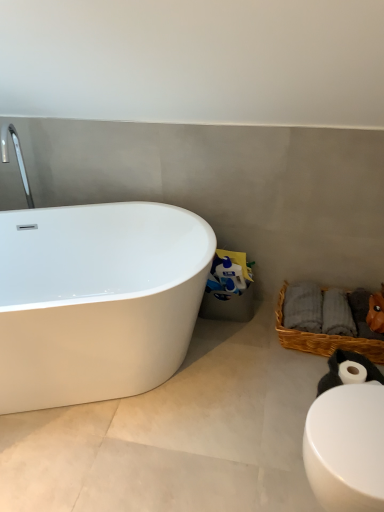
Describe the element at coordinates (337, 370) in the screenshot. I see `white matte toilet paper roll at lower right` at that location.

Describe the element at coordinates (97, 300) in the screenshot. I see `white glossy bathtub at left` at that location.

At what (x,y) coordinates should I click in order to perform the action: click on woven brown basket at lower right. Please return your answer as a coordinate pair (x, y). The image size is (384, 512). Looking at the image, I should click on (323, 339).

In order to click on white matte toilet paper roll at lower right in this screenshot , I will do `click(337, 370)`.

Find the location of a particular element. toilet that is under the white glossy bathtub at left (from a real-world perspective) is located at coordinates (346, 448).

How many degrees apart are the facing directions of white glossy bathtub at left and white glossy toilet at lower right?

The angular difference between white glossy bathtub at left and white glossy toilet at lower right is 111 degrees.

Considering the relative sizes of white glossy bathtub at left and white glossy toilet at lower right in the image provided, is white glossy bathtub at left smaller than white glossy toilet at lower right?

Actually, white glossy bathtub at left might be larger than white glossy toilet at lower right.

How distant is white glossy bathtub at left from white glossy toilet at lower right?

white glossy bathtub at left is 93.11 centimeters from white glossy toilet at lower right.

From the picture: Considering the sizes of objects white glossy toilet at lower right and woven brown basket at lower right in the image provided, who is smaller, white glossy toilet at lower right or woven brown basket at lower right?

woven brown basket at lower right.

Is point (375, 485) closer to viewer compared to point (282, 325)?

Yes, point (375, 485) is closer to viewer.

From the image's perspective, which is below, white glossy toilet at lower right or woven brown basket at lower right?

white glossy toilet at lower right, from the image's perspective.

Is woven brown basket at lower right oriented away from white matte toilet paper roll at lower right?

No, woven brown basket at lower right is not facing the opposite direction of white matte toilet paper roll at lower right.

Is white matte toilet paper roll at lower right inside woven brown basket at lower right?

No.

Does woven brown basket at lower right have a greater width compared to white matte toilet paper roll at lower right?

Correct, the width of woven brown basket at lower right exceeds that of white matte toilet paper roll at lower right.

Is woven brown basket at lower right touching white matte toilet paper roll at lower right?

They are not placed beside each other.

Choose the correct answer: Is white matte toilet paper roll at lower right inside white glossy bathtub at left or outside it?

white matte toilet paper roll at lower right lies outside white glossy bathtub at left.

From the picture: Does white matte toilet paper roll at lower right turn towards white glossy bathtub at left?

No, white matte toilet paper roll at lower right is not turned towards white glossy bathtub at left.

Does white matte toilet paper roll at lower right have a larger size compared to white glossy bathtub at left?

No, white matte toilet paper roll at lower right is not bigger than white glossy bathtub at left.

Can you confirm if white matte toilet paper roll at lower right is shorter than white glossy bathtub at left?

In fact, white matte toilet paper roll at lower right may be taller than white glossy bathtub at left.

Between point (329, 367) and point (277, 328), which one is positioned behind?

The point (277, 328) is behind.

Does white matte toilet paper roll at lower right appear on the right side of woven brown basket at lower right?

Incorrect, white matte toilet paper roll at lower right is not on the right side of woven brown basket at lower right.

Is white matte toilet paper roll at lower right located outside woven brown basket at lower right?

Yes, white matte toilet paper roll at lower right is located beyond the bounds of woven brown basket at lower right.

From a real-world perspective, does white matte toilet paper roll at lower right sit lower than woven brown basket at lower right?

No, from a real-world perspective, white matte toilet paper roll at lower right is not below woven brown basket at lower right.

Choose the correct answer: Is white glossy bathtub at left inside white glossy bathtub at left or outside it?

white glossy bathtub at left lies outside white glossy bathtub at left.

The image size is (384, 512). What are the coordinates of `bathtub that appears behind the white glossy bathtub at left` in the screenshot? It's located at (97, 300).

Is point (110, 412) in front of point (89, 274)?

Yes, point (110, 412) is closer to viewer.

Is white glossy toilet at lower right looking in the opposite direction of white glossy bathtub at left?

No, white glossy toilet at lower right is not facing the opposite direction of white glossy bathtub at left.

Between white glossy toilet at lower right and white glossy bathtub at left, which one has smaller size?

white glossy toilet at lower right.

Which is nearer, (370, 486) or (72, 240)?

The point (370, 486) is more forward.

From a real-world perspective, which is physically below, white glossy toilet at lower right or white glossy bathtub at left?

white glossy toilet at lower right.

Locate an element on the screen. The image size is (384, 512). bathtub on the left of white glossy toilet at lower right is located at coordinates (97, 300).

What are the coordinates of `toilet that appears above the woven brown basket at lower right (from a real-world perspective)` in the screenshot? It's located at (346, 448).

From the image, which object appears to be farther from white glossy bathtub at left, white matte toilet paper roll at lower right or woven brown basket at lower right?

white matte toilet paper roll at lower right lies further to white glossy bathtub at left than the other object.

Looking at the image, which one is located further to white glossy toilet at lower right, woven brown basket at lower right or white matte toilet paper roll at lower right?

woven brown basket at lower right is further to white glossy toilet at lower right.

Looking at this image, which object lies nearer to the anchor point white glossy bathtub at left, white glossy bathtub at left or woven brown basket at lower right?

Among the two, white glossy bathtub at left is located nearer to white glossy bathtub at left.

When comparing their distances from white glossy bathtub at left, does white matte toilet paper roll at lower right or woven brown basket at lower right seem further?

white matte toilet paper roll at lower right lies further to white glossy bathtub at left than the other object.

From the image, which object appears to be farther from white glossy bathtub at left, white glossy bathtub at left or white matte toilet paper roll at lower right?

Among the two, white matte toilet paper roll at lower right is located further to white glossy bathtub at left.

When comparing their distances from white glossy toilet at lower right, does white glossy bathtub at left or white matte toilet paper roll at lower right seem closer?

white matte toilet paper roll at lower right is closer to white glossy toilet at lower right.

Looking at the image, which one is located closer to white glossy toilet at lower right, woven brown basket at lower right or white glossy bathtub at left?

white glossy bathtub at left lies closer to white glossy toilet at lower right than the other object.

Based on their spatial positions, is white glossy bathtub at left or white matte toilet paper roll at lower right further from woven brown basket at lower right?

white glossy bathtub at left is further to woven brown basket at lower right.

I want to click on concrete between white glossy toilet at lower right and white matte toilet paper roll at lower right from front to back, so click(x=177, y=434).

Image resolution: width=384 pixels, height=512 pixels. Identify the location of toilet between white glossy bathtub at left and white matte toilet paper roll at lower right. (346, 448).

The image size is (384, 512). I want to click on concrete between white glossy bathtub at left and white matte toilet paper roll at lower right from left to right, so click(177, 434).

Locate an element on the screen. The image size is (384, 512). concrete between white glossy bathtub at left and white glossy toilet at lower right in the horizontal direction is located at coordinates (177, 434).